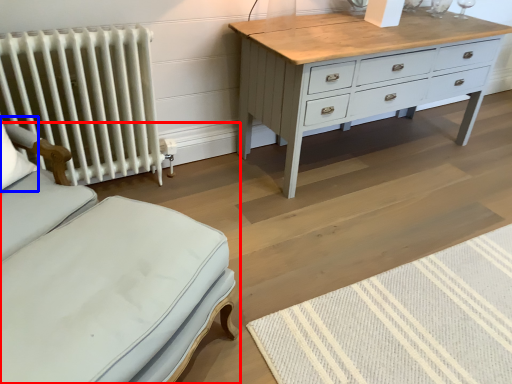
Question: Which of the following is the farthest to the observer, furniture (highlighted by a red box) or pillow (highlighted by a blue box)?

Choices:
 (A) furniture
 (B) pillow

Answer: (B)